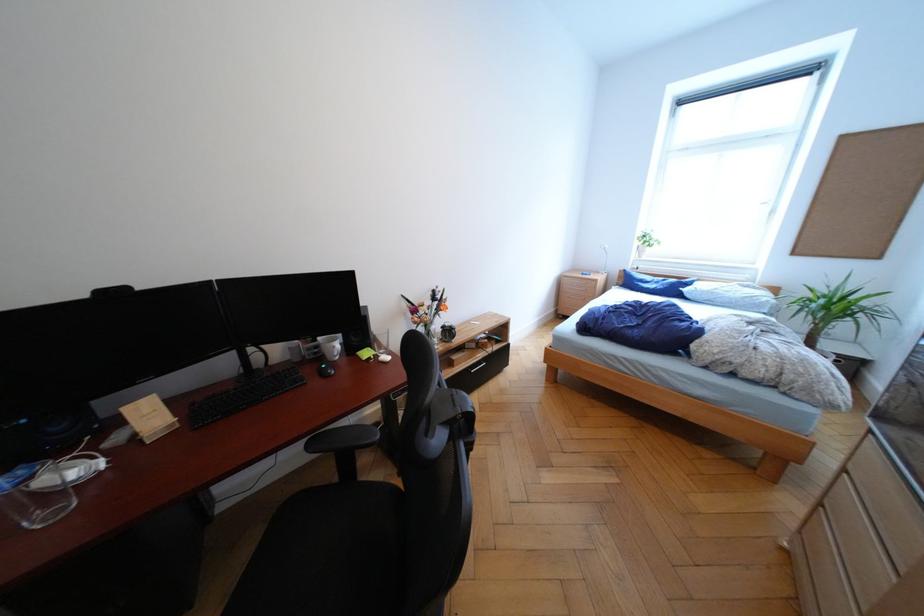
Where would you sit the chair sitting surface? Please return your answer as a coordinate pair (x, y).

(333, 560)